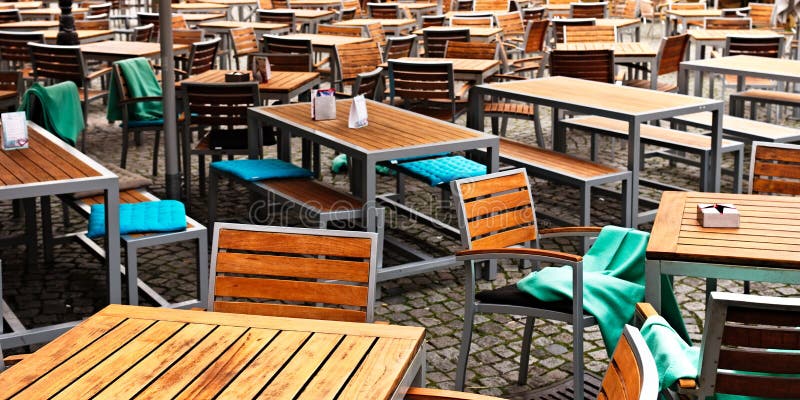
At what (x,y) coordinates should I click in order to perform the action: click on benches. Please return your answer as a coordinate pair (x, y). The image size is (800, 400). Looking at the image, I should click on (138, 192), (308, 192), (548, 151), (422, 166), (676, 136), (749, 118), (770, 95).